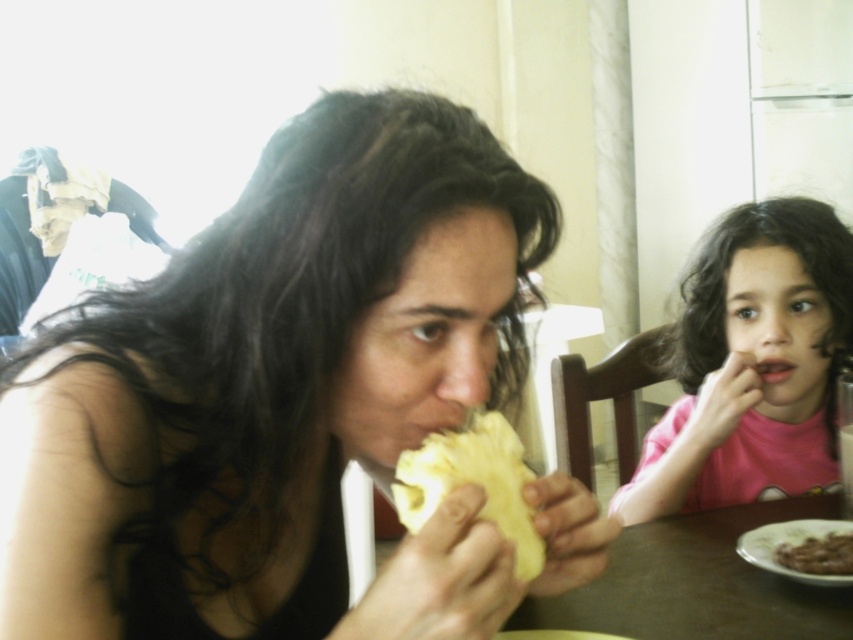
Which is above, yellow matte pineapple at center or brown crumbly cake at lower right?

yellow matte pineapple at center is above.

In the scene shown: Which is more to the left, yellow matte pineapple at center or brown crumbly cake at lower right?

Positioned to the left is yellow matte pineapple at center.

Describe the element at coordinates (473, 483) in the screenshot. I see `yellow matte pineapple at center` at that location.

Locate an element on the screen. The width and height of the screenshot is (853, 640). yellow matte pineapple at center is located at coordinates (473, 483).

Is point (585, 595) farther from viewer compared to point (813, 538)?

No, it is in front of (813, 538).

Can you confirm if brown wooden table at lower center is wider than brown crumbly cake at lower right?

Yes, brown wooden table at lower center is wider than brown crumbly cake at lower right.

Between point (753, 614) and point (811, 554), which one is positioned in front?

Point (753, 614) is more forward.

This screenshot has height=640, width=853. I want to click on brown wooden table at lower center, so click(x=698, y=582).

Is pink matte shirt at upper right to the right of brown crumbly cake at lower right from the viewer's perspective?

Indeed, pink matte shirt at upper right is positioned on the right side of brown crumbly cake at lower right.

Which is more to the right, pink matte shirt at upper right or brown crumbly cake at lower right?

Positioned to the right is pink matte shirt at upper right.

I want to click on pink matte shirt at upper right, so click(x=752, y=364).

The width and height of the screenshot is (853, 640). In order to click on pink matte shirt at upper right in this screenshot , I will do `click(752, 364)`.